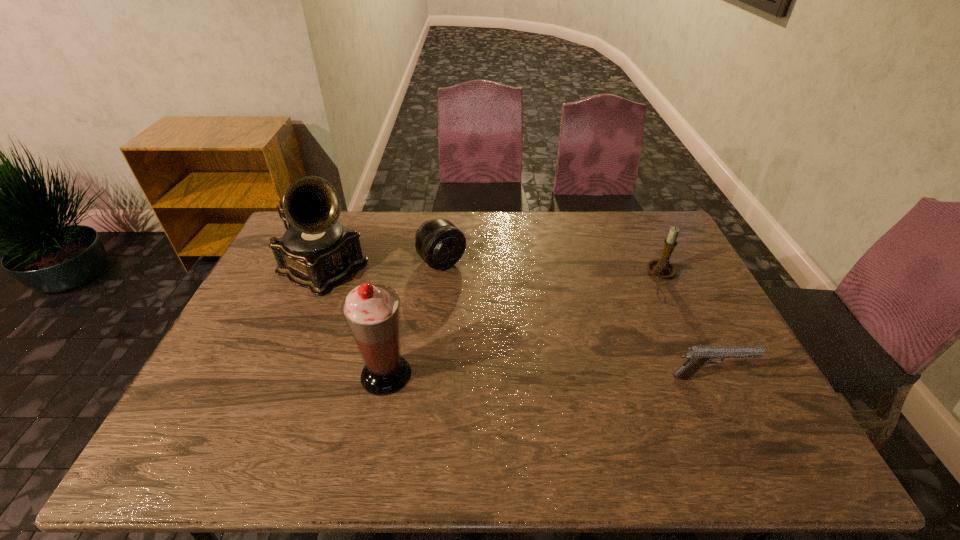
The height and width of the screenshot is (540, 960). Identify the location of vacant region located 0.220m on the front-facing side of the fourth tallest object. (494, 315).

The width and height of the screenshot is (960, 540). Find the location of `free region located 0.350m on the front-facing side of the fourth tallest object`. free region located 0.350m on the front-facing side of the fourth tallest object is located at coordinates (522, 344).

At what (x,y) coordinates should I click in order to perform the action: click on free region located 0.250m on the front-facing side of the fourth tallest object. Please return your answer as a coordinate pair (x, y). The width and height of the screenshot is (960, 540). Looking at the image, I should click on (500, 322).

At what (x,y) coordinates should I click in order to perform the action: click on free space located 0.120m on the horn of the tallest object. Please return your answer as a coordinate pair (x, y). The height and width of the screenshot is (540, 960). Looking at the image, I should click on (382, 302).

This screenshot has height=540, width=960. I want to click on vacant space situated 0.280m on the horn of the tallest object, so click(x=424, y=323).

Where is `free space located on the horn of the tallest object`? This screenshot has height=540, width=960. free space located on the horn of the tallest object is located at coordinates (393, 307).

The height and width of the screenshot is (540, 960). I want to click on telephoto lens that is at the far edge, so click(440, 244).

Locate an element on the screen. This screenshot has width=960, height=540. phonograph record at the far edge is located at coordinates (316, 252).

You are a GUI agent. You are given a task and a screenshot of the screen. Output one action in this format:
    pyautogui.click(x=<x>, y=<y>)
    Task: Click on the object at the near edge
    The image size is (960, 540).
    Given the screenshot: What is the action you would take?
    pyautogui.click(x=371, y=311)

Locate an element on the screen. The width and height of the screenshot is (960, 540). object present at the left edge is located at coordinates (316, 252).